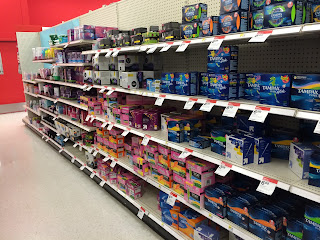
Locate an element on the screen. This screenshot has width=320, height=240. corner of beige wall is located at coordinates (38, 34).